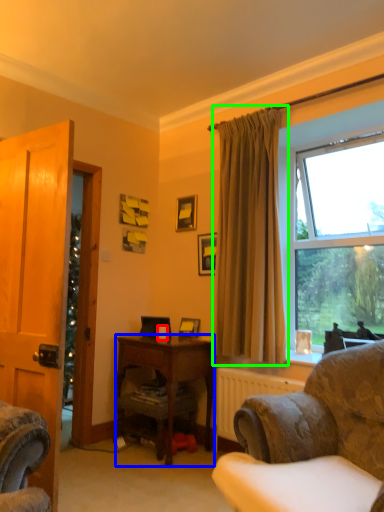
Question: Considering the real-world distances, which object is farthest from coffee cup (highlighted by a red box)? desk (highlighted by a blue box) or curtain (highlighted by a green box)?

Choices:
 (A) desk
 (B) curtain

Answer: (B)